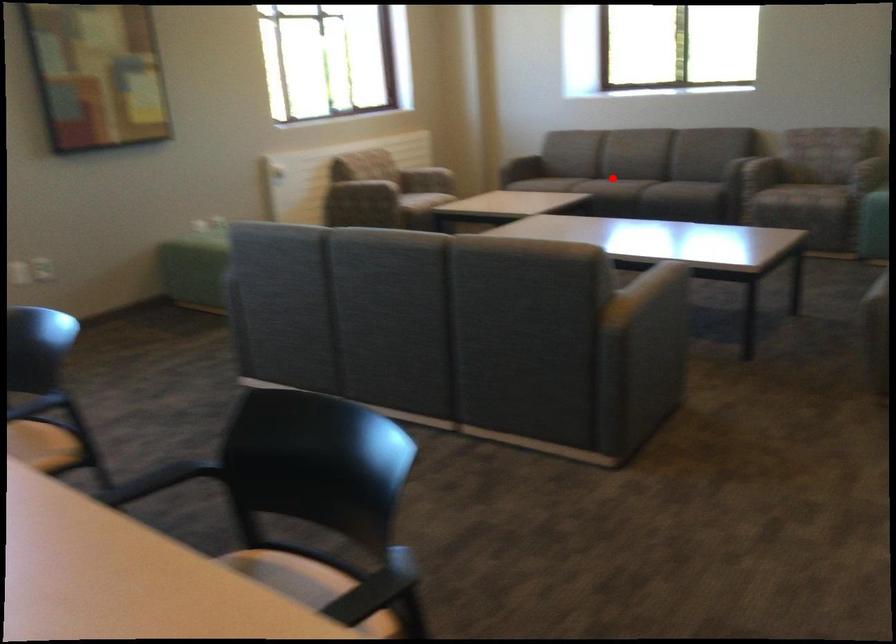
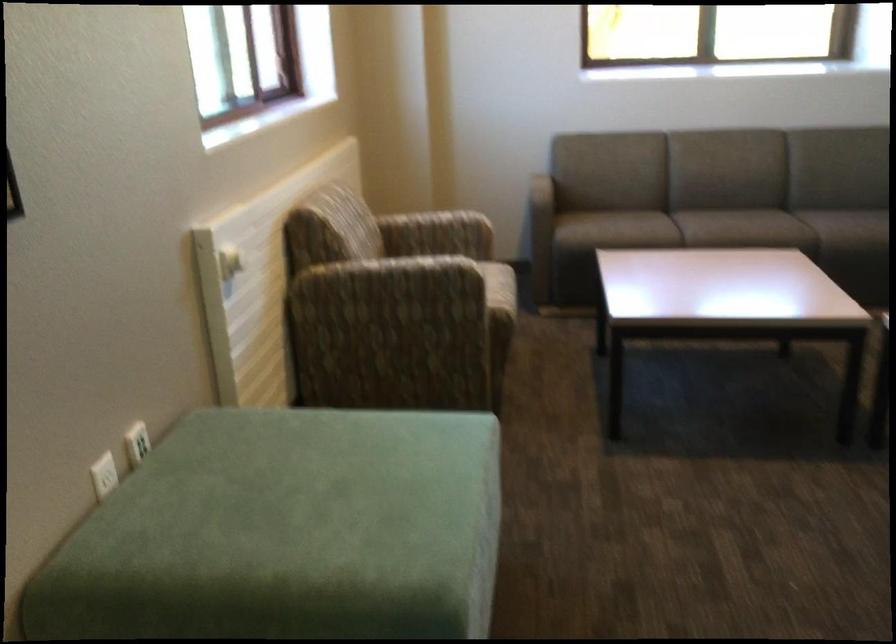
The point at the highlighted location is marked in the first image. Where is the corresponding point in the second image?

(780, 229)